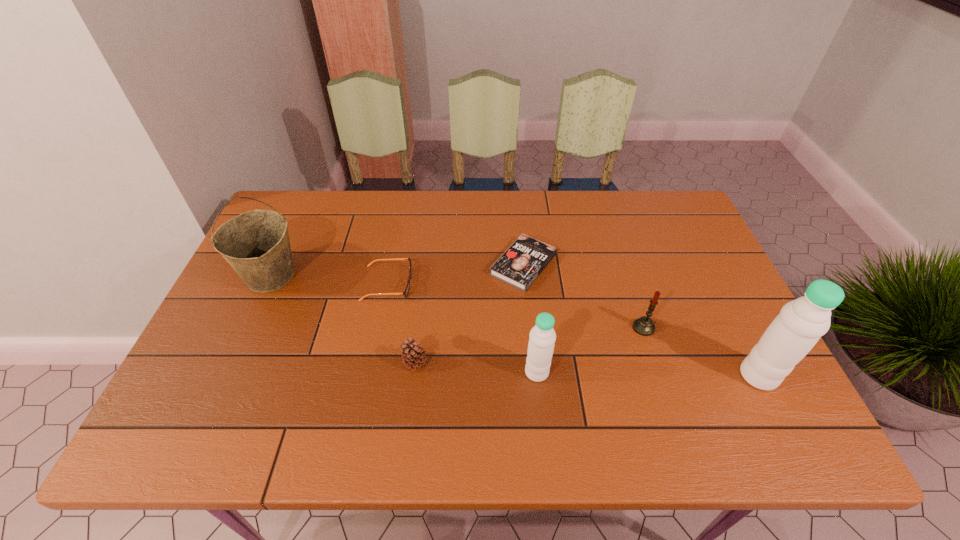
Where is `free space that satisfies the following two spatial constraints: 1. on the front-facing side of the sixth object from right to left; 2. on the right side of the sixth object from left to right`? This screenshot has width=960, height=540. free space that satisfies the following two spatial constraints: 1. on the front-facing side of the sixth object from right to left; 2. on the right side of the sixth object from left to right is located at coordinates (379, 328).

This screenshot has width=960, height=540. What are the coordinates of `free space that satisfies the following two spatial constraints: 1. on the back side of the leftmost object; 2. on the left side of the shortest object` in the screenshot? It's located at (276, 265).